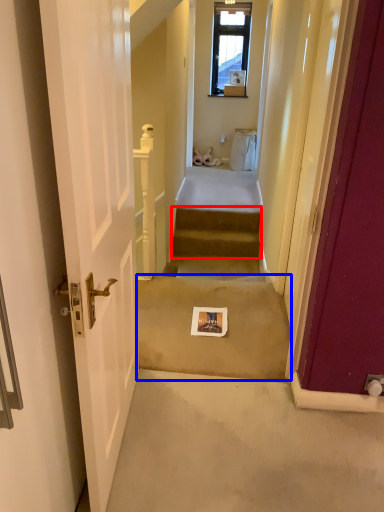
Question: Which object is further to the camera taking this photo, stairs (highlighted by a red box) or concrete (highlighted by a blue box)?

Choices:
 (A) stairs
 (B) concrete

Answer: (A)